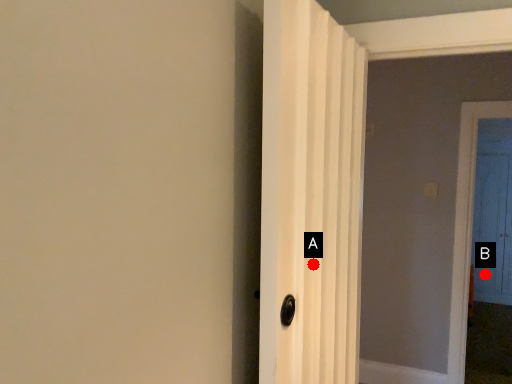
Question: Two points are circled on the image, labeled by A and B beside each circle. Which point is closer to the camera?

Choices:
 (A) A is closer
 (B) B is closer

Answer: (A)